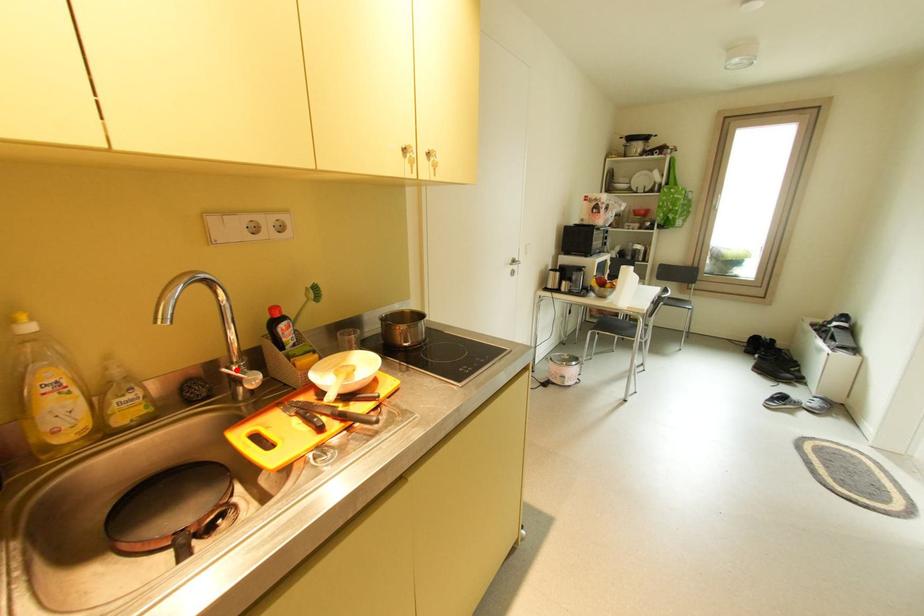
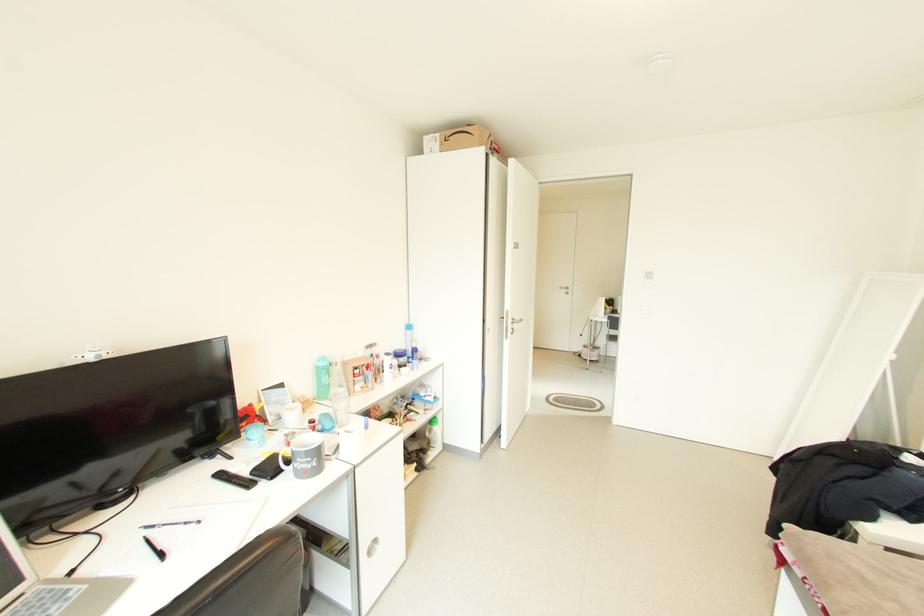
Question: I am providing you with two images of the same scene from different viewpoints. A red point is marked on the first image. At the location where the point appears in image 1, is it still visible in image 2?

Choices:
 (A) Yes
 (B) No

Answer: (B)